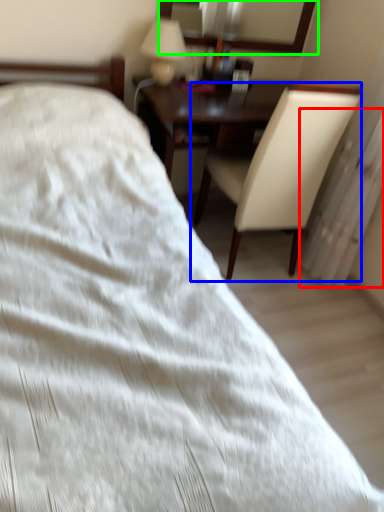
Question: Which object is positioned farthest from radiator (highlighted by a red box)? Select from chair (highlighted by a blue box) and mirror (highlighted by a green box).

Choices:
 (A) chair
 (B) mirror

Answer: (B)